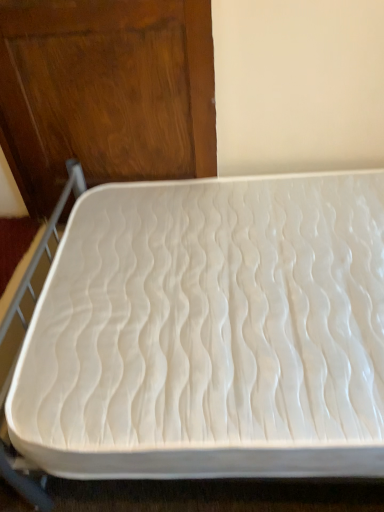
Locate an element on the screen. white textured mattress at center is located at coordinates (208, 315).

What is the approximate height of white textured mattress at center?

34.21 inches.

This screenshot has height=512, width=384. Describe the element at coordinates (208, 315) in the screenshot. I see `white textured mattress at center` at that location.

You are a GUI agent. You are given a task and a screenshot of the screen. Output one action in this format:
    pyautogui.click(x=<x>, y=<y>)
    Task: Click on the white textured mattress at center
    
    Given the screenshot: What is the action you would take?
    pyautogui.click(x=208, y=315)